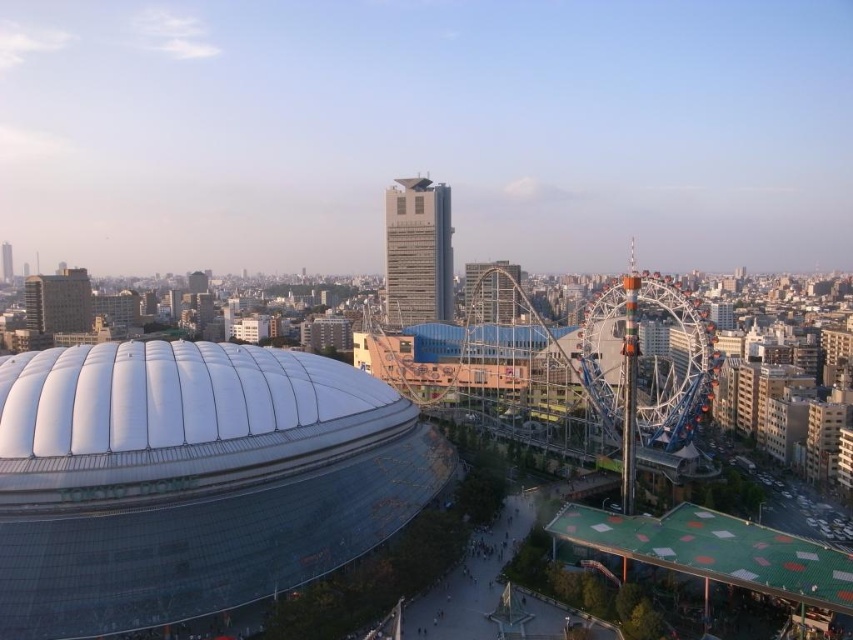
Between transparent glass dome at center and multicolored metallic ferris wheel at right, which one appears on the left side from the viewer's perspective?

Positioned to the left is transparent glass dome at center.

Can you confirm if transparent glass dome at center is positioned above multicolored metallic ferris wheel at right?

Indeed, transparent glass dome at center is positioned over multicolored metallic ferris wheel at right.

I want to click on transparent glass dome at center, so click(x=192, y=480).